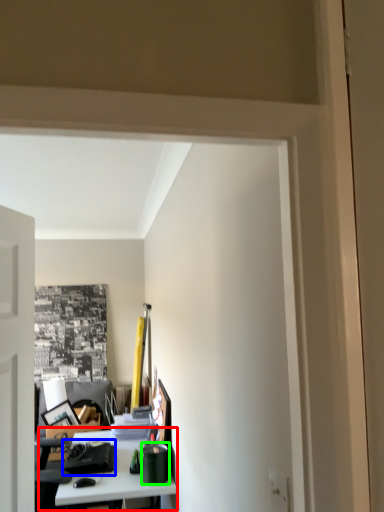
Question: Which is farther away from table (highlighted by a red box)? stationery (highlighted by a blue box) or stationery (highlighted by a green box)?

Choices:
 (A) stationery
 (B) stationery

Answer: (B)